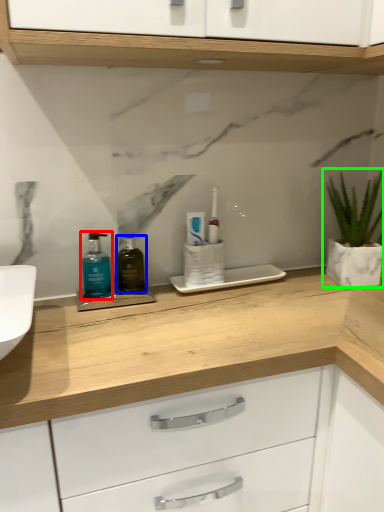
Question: Which object is positioned farthest from mouthwash (highlighted by a red box)? Select from mouthwash (highlighted by a blue box) and houseplant (highlighted by a green box).

Choices:
 (A) mouthwash
 (B) houseplant

Answer: (B)